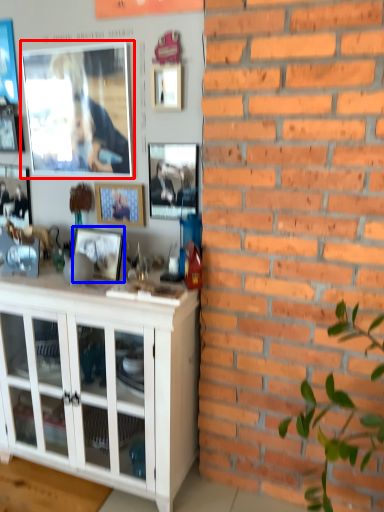
Question: Which object is further to the camera taking this photo, picture frame (highlighted by a red box) or picture frame (highlighted by a blue box)?

Choices:
 (A) picture frame
 (B) picture frame

Answer: (A)